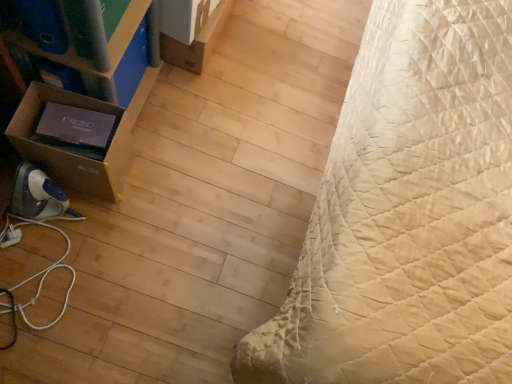
Identify the location of free space to the right of brown cardboard box at upper left, the 1th cardboard box when ordered from back to front. pyautogui.click(x=256, y=66).